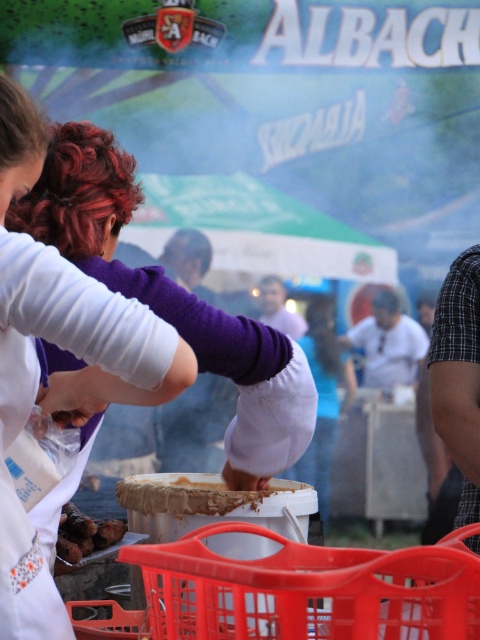
You are a chef preparing food at a festival. You see the purple matte sweater at center and the brown matte skewers at lower left. Which item is covering the other?

The purple matte sweater at center is positioned over brown matte skewers at lower left, so the sweater is covering the skewers.

You are standing at the center of the scene and need to place a new object exactly at the coordinates mentioned in the description of the purple matte sweater at center. Where should you place it?

The purple matte sweater at center should be placed at the coordinates point (63, 372) as specified in the description.

You are setting up a food stall at a festival and need to place the white matte bowl at center and the brown matte skewers at lower left. Given their sizes, which object should you prioritize placing first to ensure they fit properly?

The white matte bowl at center is larger in size than the brown matte skewers at lower left, so you should prioritize placing the white matte bowl at center first to ensure there is enough space for it before arranging the smaller skewers.